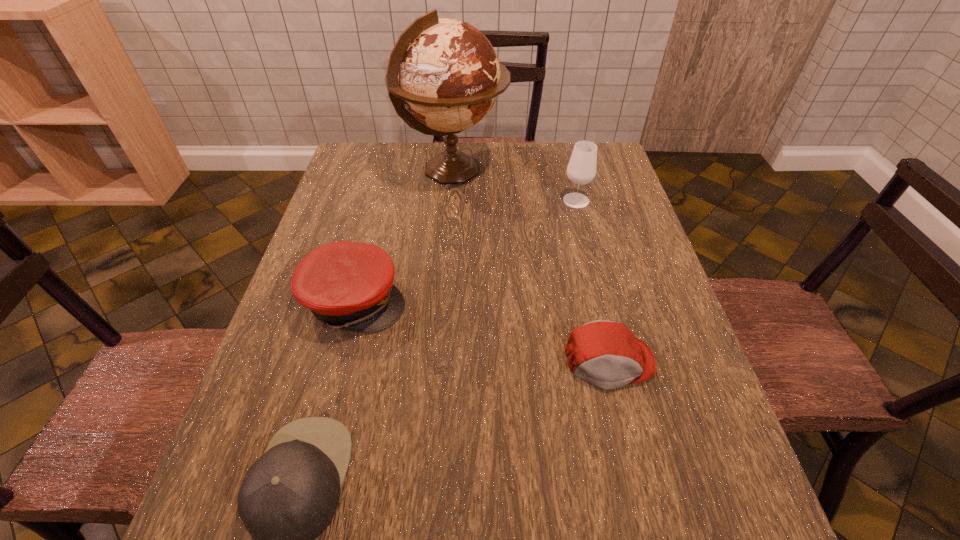
Find the location of a particular element. Image resolution: width=960 pixels, height=540 pixels. cap that is at the right edge is located at coordinates (607, 354).

The image size is (960, 540). What are the coordinates of `vacant area at the far edge of the desktop` in the screenshot? It's located at (512, 171).

I want to click on free region at the left edge, so click(x=383, y=201).

In the image, there is a desktop. Identify the location of vacant region at the right edge. The width and height of the screenshot is (960, 540). (644, 271).

This screenshot has height=540, width=960. In order to click on vacant space at the far left corner in this screenshot , I will do `click(366, 162)`.

The height and width of the screenshot is (540, 960). In order to click on free space between the glass and the globe in this screenshot , I will do `click(515, 186)`.

Image resolution: width=960 pixels, height=540 pixels. Identify the location of empty space between the glass and the tallest object. (515, 186).

The image size is (960, 540). I want to click on object that stands as the third closest to the nearest object, so click(x=444, y=71).

This screenshot has width=960, height=540. Find the location of `the third closest object to the fourth shortest object`. the third closest object to the fourth shortest object is located at coordinates (349, 285).

Select which cap is the second closest to the shortest cap. Please provide its 2D coordinates. Your answer should be formatted as a tuple, i.e. [(x, y)], where the tuple contains the x and y coordinates of a point satisfying the conditions above.

[(288, 497)]